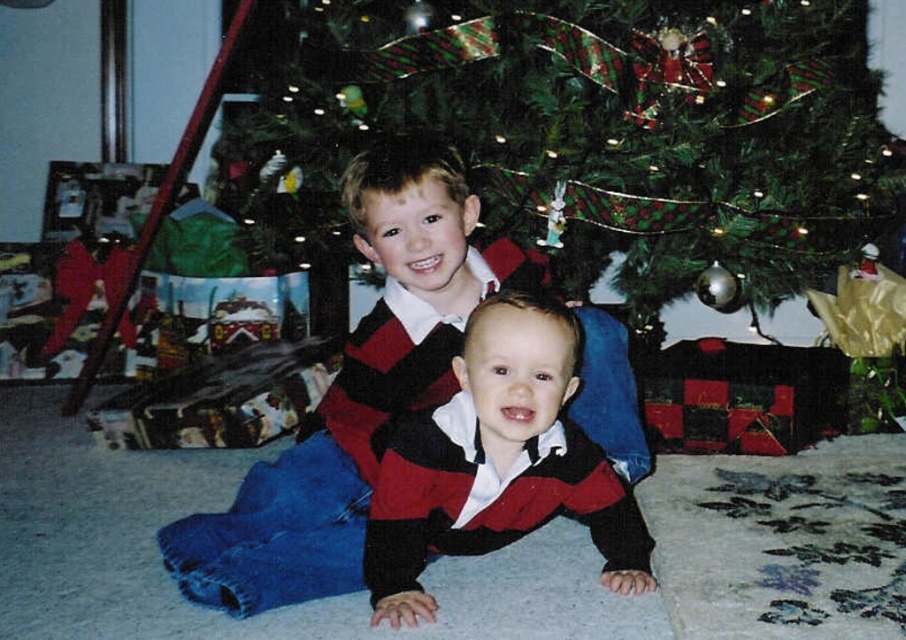
Which is below, green textured christmas tree at upper center or knit sweater at center?

knit sweater at center is lower down.

Where is `green textured christmas tree at upper center`? Image resolution: width=906 pixels, height=640 pixels. green textured christmas tree at upper center is located at coordinates (619, 122).

Locate an element on the screen. green textured christmas tree at upper center is located at coordinates (619, 122).

Does point (747, 228) lie behind point (355, 586)?

Yes, it is.

Looking at this image, does green textured christmas tree at upper center appear over matte red sweater at center?

Yes.

Between point (702, 310) and point (426, 237), which one is positioned behind?

The point (702, 310) is more distant.

This screenshot has width=906, height=640. I want to click on green textured christmas tree at upper center, so click(x=619, y=122).

Does matte red sweater at center come behind knit sweater at center?

Yes.

Does point (241, 522) lie in front of point (545, 307)?

No, (241, 522) is further to viewer.

Identify the location of matte red sweater at center. The width and height of the screenshot is (906, 640). (350, 394).